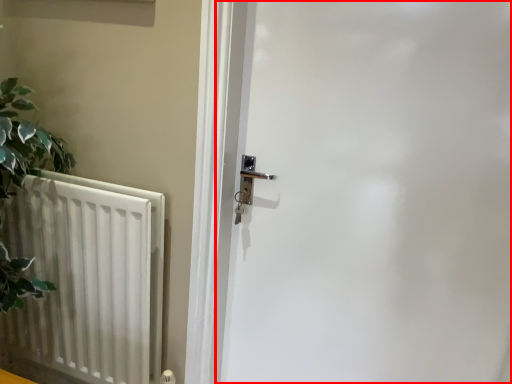
Question: Considering the relative positions of door (annotated by the red box) and radiator in the image provided, where is door (annotated by the red box) located with respect to the staircase?

Choices:
 (A) left
 (B) right

Answer: (B)